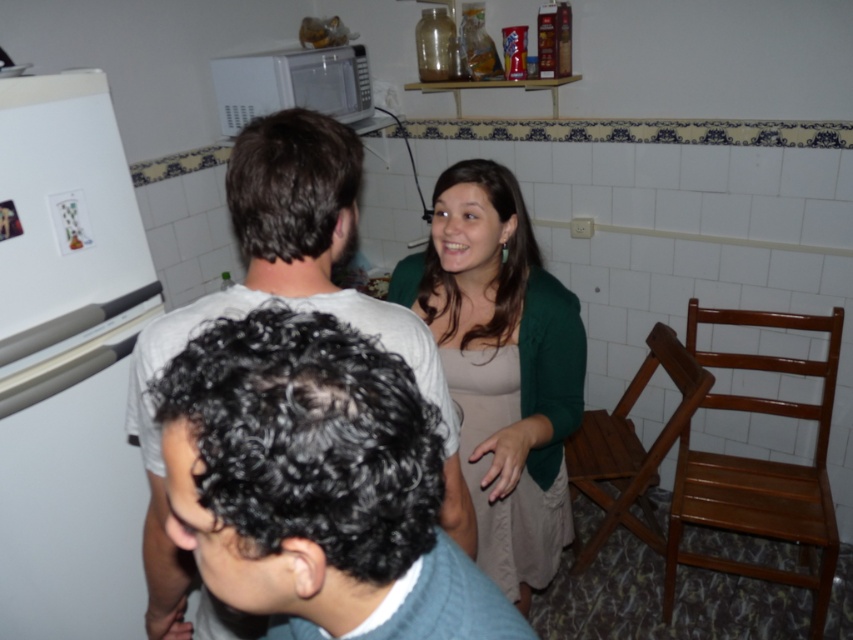
Is dark brown hair at center taller than white matte microwave at upper center?

Correct, dark brown hair at center is much taller as white matte microwave at upper center.

What do you see at coordinates (287, 304) in the screenshot? I see `dark brown hair at center` at bounding box center [287, 304].

Image resolution: width=853 pixels, height=640 pixels. I want to click on dark brown hair at center, so click(x=287, y=304).

Is white matte refrigerator at left closer to camera compared to white matte microwave at upper center?

Yes, it is in front of white matte microwave at upper center.

Based on the photo, between white matte refrigerator at left and white matte microwave at upper center, which one appears on the right side from the viewer's perspective?

Positioned to the right is white matte microwave at upper center.

Between point (71, 120) and point (296, 104), which one is positioned in front?

Point (71, 120) is in front.

You are a GUI agent. You are given a task and a screenshot of the screen. Output one action in this format:
    pyautogui.click(x=<x>, y=<y>)
    Task: Click on the white matte refrigerator at left
    
    Given the screenshot: What is the action you would take?
    pyautogui.click(x=68, y=364)

Which is below, green matte dress at center or dark brown hair at center?

Positioned lower is green matte dress at center.

In the scene shown: Can you confirm if green matte dress at center is shorter than dark brown hair at center?

In fact, green matte dress at center may be taller than dark brown hair at center.

What do you see at coordinates (502, 368) in the screenshot?
I see `green matte dress at center` at bounding box center [502, 368].

Identify the location of green matte dress at center. The width and height of the screenshot is (853, 640). (502, 368).